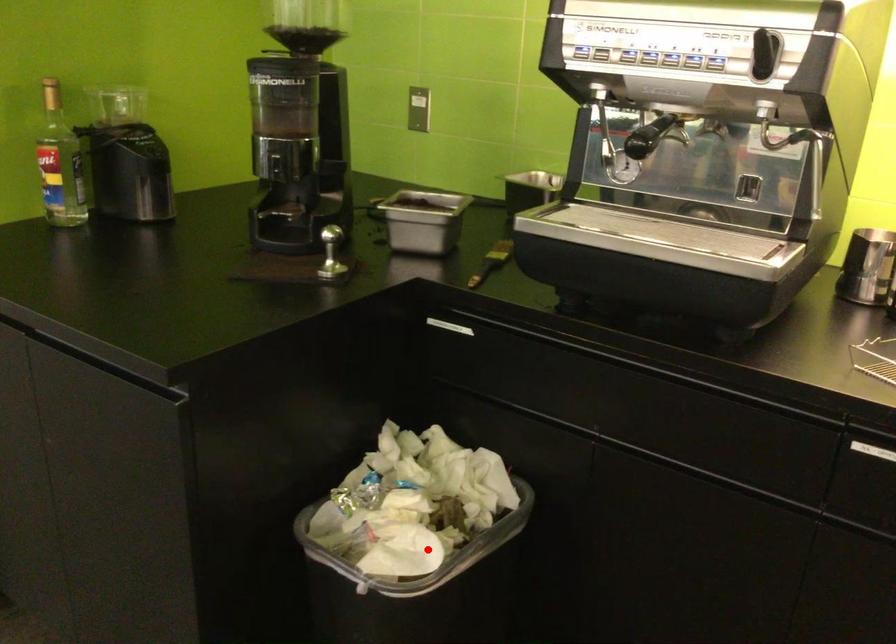
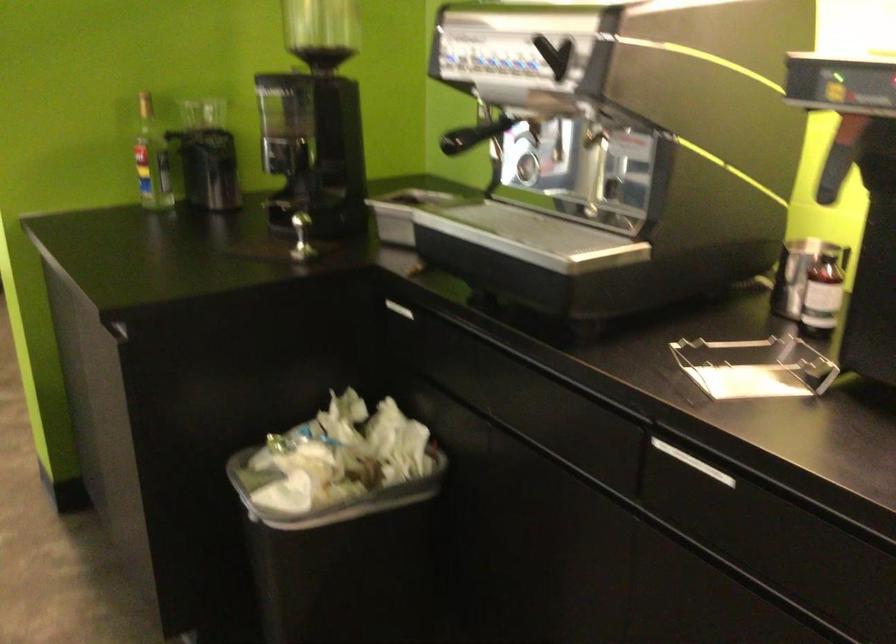
Question: I am providing you with two images of the same scene from different viewpoints. Given a red point in image1, look at the same physical point in image2. Is it:

Choices:
 (A) Closer to the viewpoint
 (B) Farther from the viewpoint

Answer: (B)